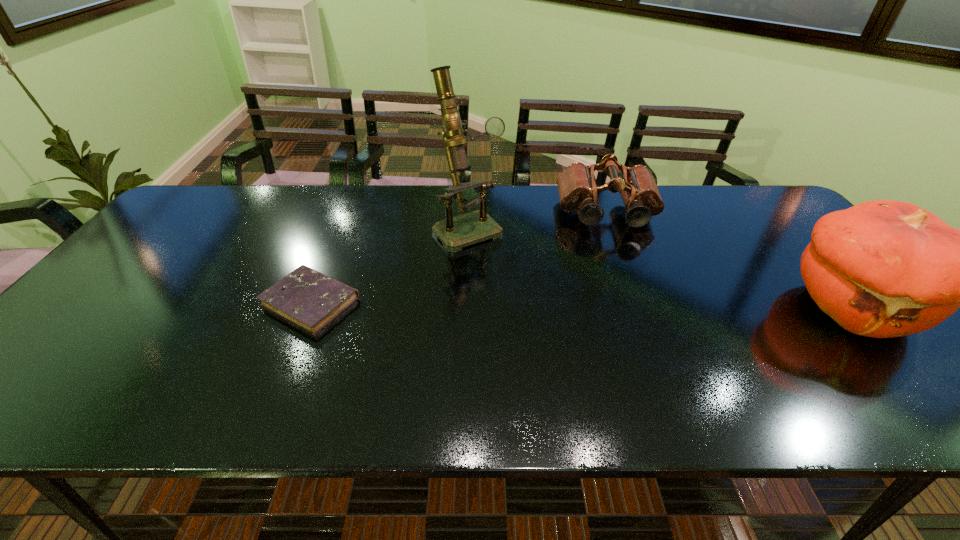
The width and height of the screenshot is (960, 540). I want to click on vacant space that's between the tallest object and the diary, so click(x=389, y=265).

You are a GUI agent. You are given a task and a screenshot of the screen. Output one action in this format:
    pyautogui.click(x=<x>, y=<y>)
    Task: Click on the free space between the tallest object and the second object from right to left
    This screenshot has height=540, width=960.
    Given the screenshot: What is the action you would take?
    pyautogui.click(x=538, y=221)

Find the location of a particular element. blank region between the binoculars and the diary is located at coordinates (459, 257).

This screenshot has height=540, width=960. What are the coordinates of `unoccupied position between the tallest object and the shortest object` in the screenshot? It's located at (389, 265).

Choose which object is the second nearest neighbor to the pumpkin. Please provide its 2D coordinates. Your answer should be formatted as a tuple, i.e. [(x, y)], where the tuple contains the x and y coordinates of a point satisfying the conditions above.

[(457, 232)]

Locate an element on the screen. object that is the nearest to the tallest object is located at coordinates (577, 189).

Locate an element on the screen. free location that satisfies the following two spatial constraints: 1. on the back side of the leftmost object; 2. on the right side of the microscope is located at coordinates (341, 228).